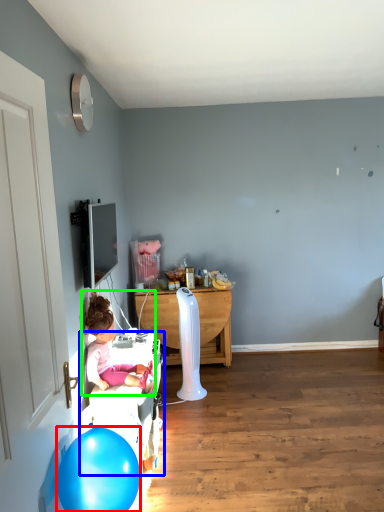
Question: Which object is positioned farthest from balloon (highlighted by a red box)? Select from bed frame (highlighted by a blue box) and person (highlighted by a green box).

Choices:
 (A) bed frame
 (B) person

Answer: (B)